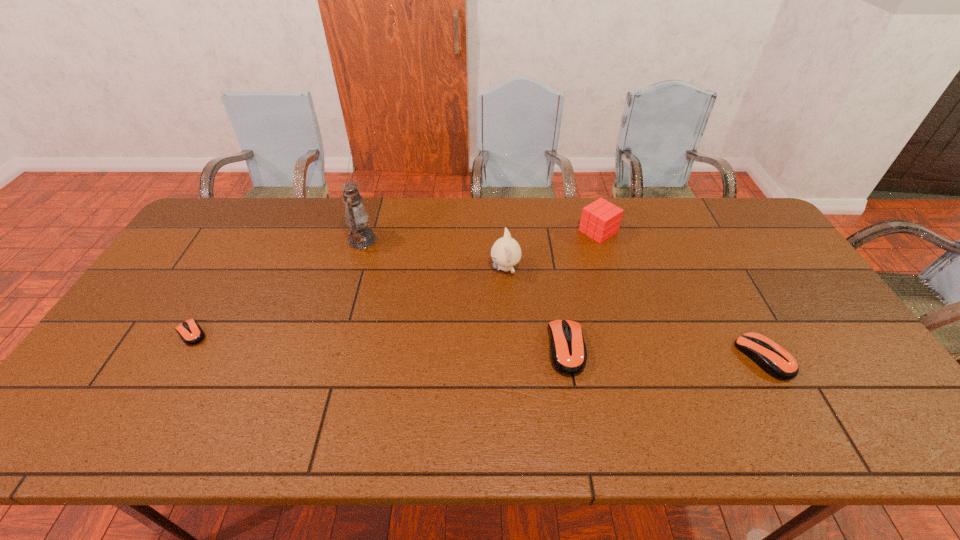
To make them evenly spaced by inserting another mouse_(computer_equipment) among them, please locate a vacant spot for this new mouse_(computer_equipment). Please provide its 2D coordinates. Your answer should be formatted as a tuple, i.e. [(x, y)], where the tuple contains the x and y coordinates of a point satisfying the conditions above.

[(376, 341)]